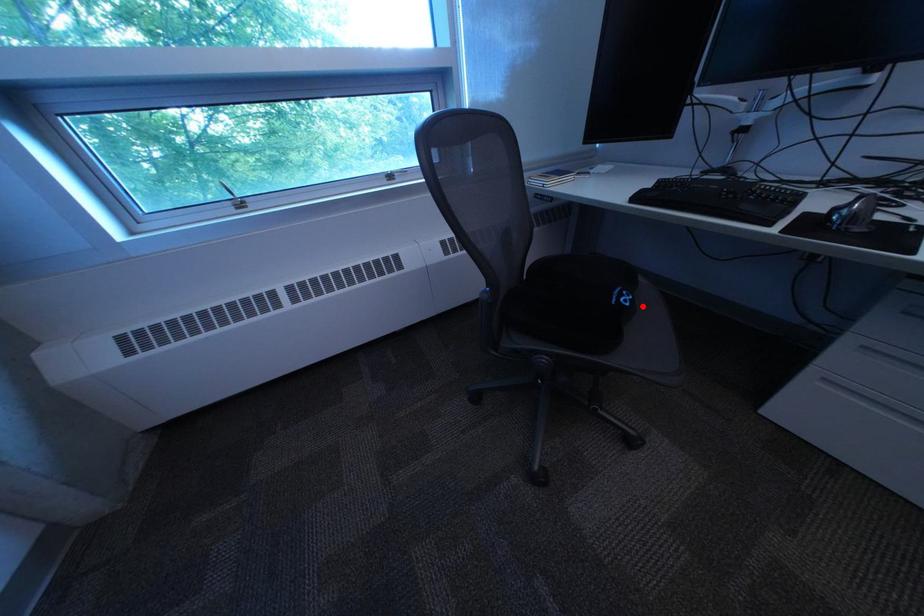
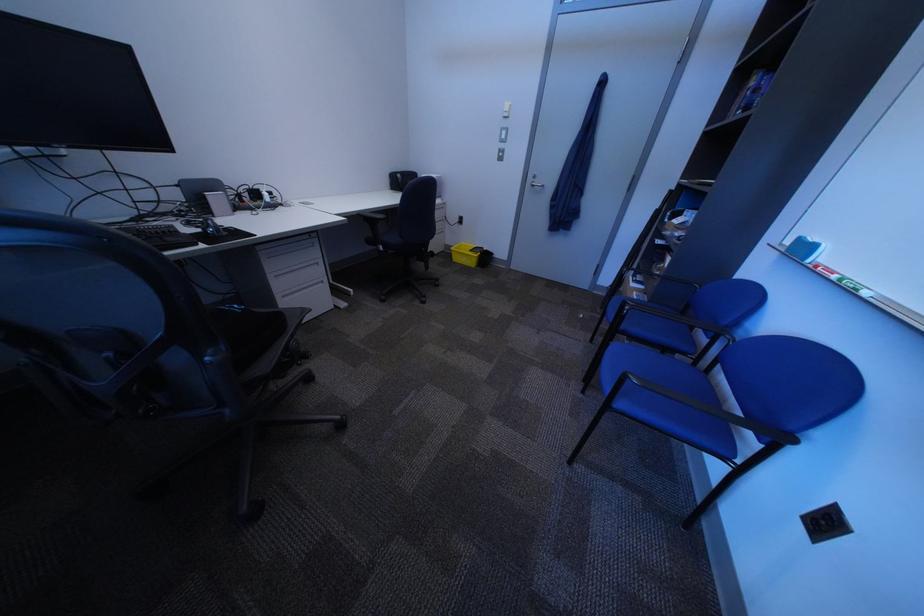
In the second image, find the point that corresponds to the highlighted location in the first image.

(259, 309)